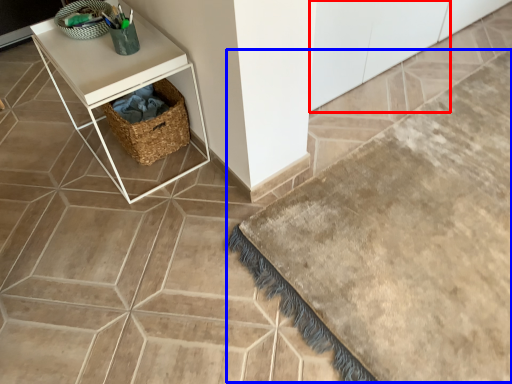
Question: Which object is closer to the camera taking this photo, cabinetry (highlighted by a red box) or bath mat (highlighted by a blue box)?

Choices:
 (A) cabinetry
 (B) bath mat

Answer: (B)